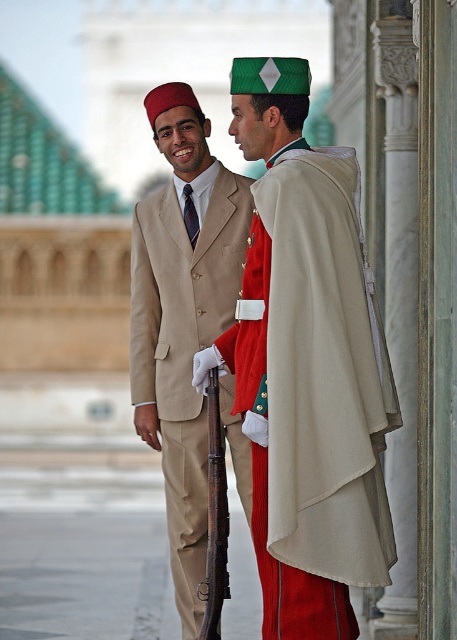
Is matte beige suit at center to the left of beige wool suit at center from the viewer's perspective?

No, matte beige suit at center is not to the left of beige wool suit at center.

Between point (243, 419) and point (142, 348), which one is positioned behind?

Positioned behind is point (142, 348).

Is point (255, 541) in front of point (182, 598)?

Yes, point (255, 541) is closer to viewer.

Where is `matte beige suit at center`? matte beige suit at center is located at coordinates (307, 365).